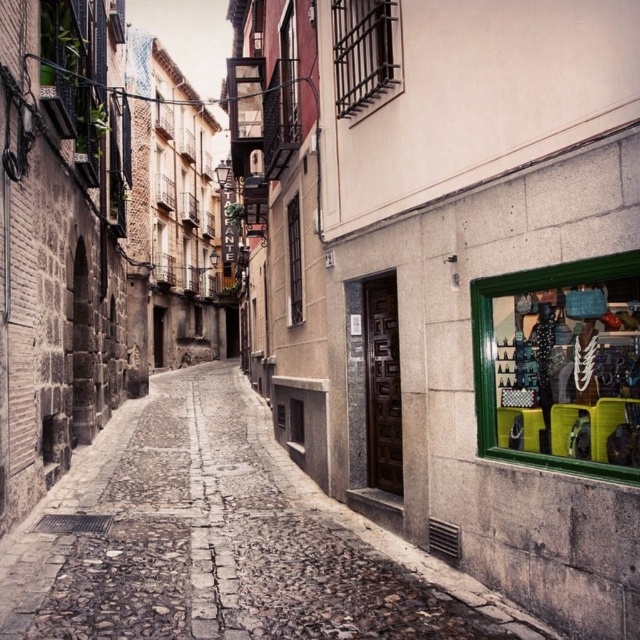
You are standing in the middle of a narrow cobblestone street in a European city. There is a point marked at coordinates (179, 609). Can you estimate how far you are from this point?

The point at (179, 609) is 4.88 meters away from the viewer, so you are approximately 4.88 meters away from this point.

You are a delivery person carrying a large package and need to walk through the narrow cobblestone street shown in the image. The package is 4 meters long. Can you safely navigate the cobblestone at center without the package hitting anything?

The cobblestone at center is 4.35 meters from the camera. Since the package is 4 meters long, it is shorter than the available space, so you can safely navigate the cobblestone at center without the package hitting anything.

You are a delivery person with a cart that is 1.2 meters wide. You need to move from the cobblestone at center to the green plastic baskets at right. Is there enough space between them for your cart to pass through?

The distance between the cobblestone at center and the green plastic baskets at right is 3.60 meters. Since your cart is only 1.2 meters wide, there is sufficient space for it to pass through.